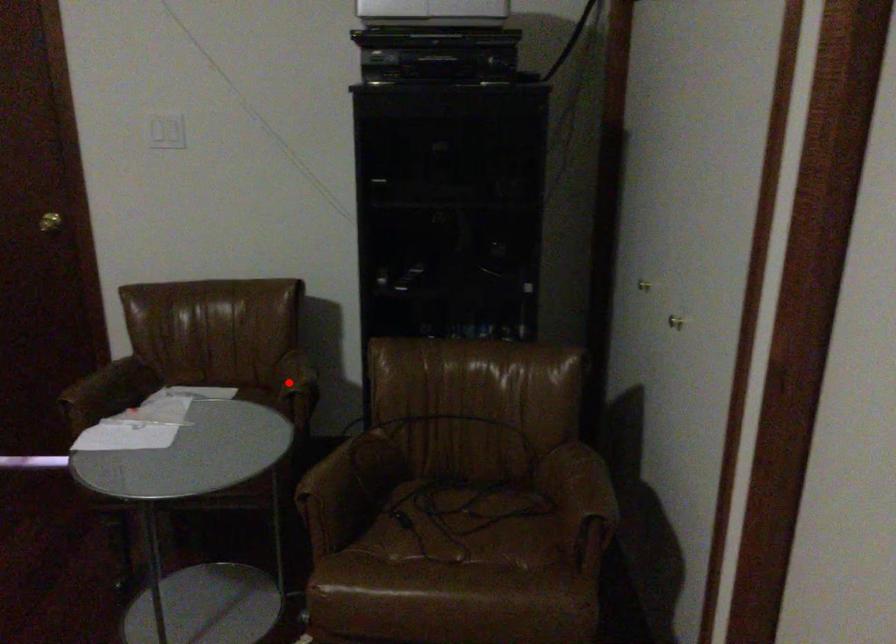
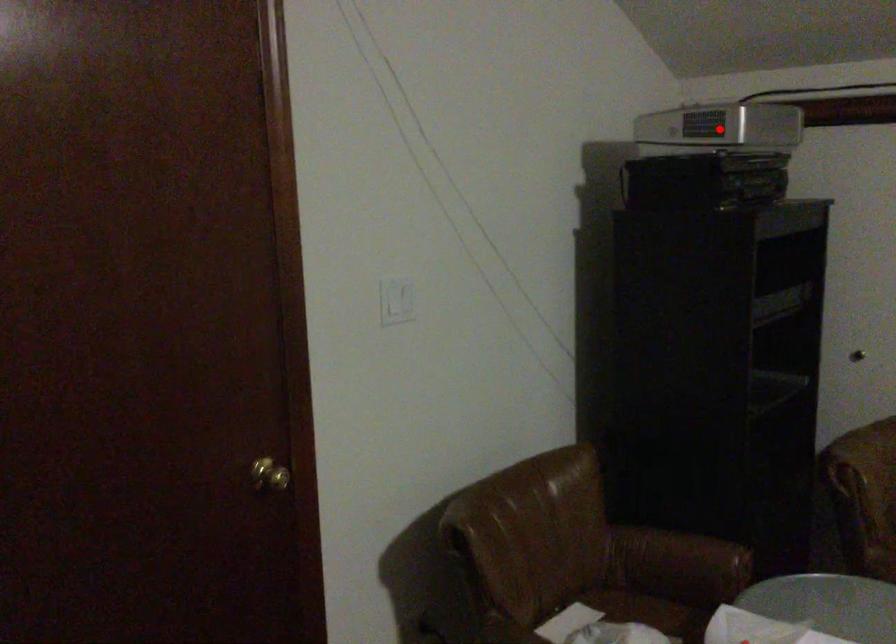
I am providing you with two images of the same scene from different viewpoints. A red point is marked on the first image and another point is marked on the second image. Are the points marked in image1 and image2 representing the same 3D position?

No